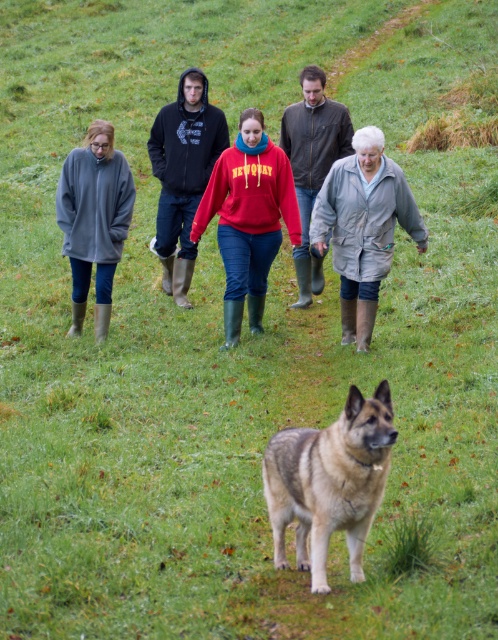
Does matte gray sweater at upper center appear under matte brown jacket at center?

Yes.

Locate an element on the screen. The height and width of the screenshot is (640, 498). matte gray sweater at upper center is located at coordinates (237, 221).

Can you confirm if brown fur dog at center is thinner than matte brown jacket at center?

Yes, brown fur dog at center is thinner than matte brown jacket at center.

Where is `brown fur dog at center`? The image size is (498, 640). brown fur dog at center is located at coordinates (330, 483).

At what (x,y) coordinates should I click in order to perform the action: click on brown fur dog at center. Please return your answer as a coordinate pair (x, y). Looking at the image, I should click on (330, 483).

Is red fleece sweatshirt at center above matte brown jacket at center?

Actually, red fleece sweatshirt at center is below matte brown jacket at center.

Which of these two, red fleece sweatshirt at center or matte brown jacket at center, stands taller?

red fleece sweatshirt at center is taller.

Between point (278, 193) and point (287, 124), which one is positioned behind?

The point (287, 124) is more distant.

Where is `red fleece sweatshirt at center`? red fleece sweatshirt at center is located at coordinates (249, 218).